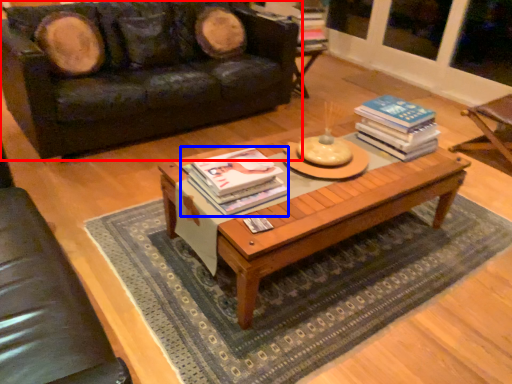
Question: Which of the following is the farthest to the observer, studio couch (highlighted by a red box) or book (highlighted by a blue box)?

Choices:
 (A) studio couch
 (B) book

Answer: (A)